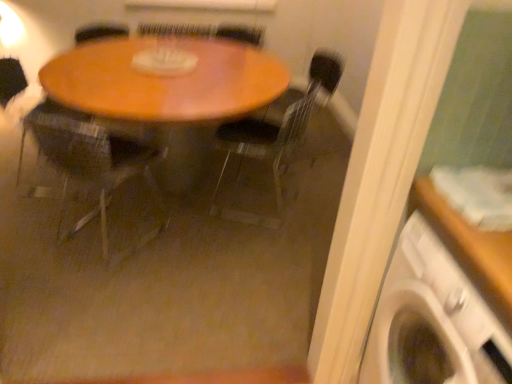
This screenshot has width=512, height=384. In order to click on wooden chair at center, marked as the second chair in a right-to-left arrangement in this screenshot , I will do `click(92, 162)`.

What do you see at coordinates (92, 162) in the screenshot? I see `wooden chair at center, marked as the second chair in a right-to-left arrangement` at bounding box center [92, 162].

In the scene shown: What is the approximate height of transparent plastic chair at center, which ranks as the first chair in right-to-left order?

29.28 inches.

Find the location of a particular element. The width and height of the screenshot is (512, 384). white plastic washing machine at lower right is located at coordinates (433, 321).

Locate an element on the screen. The height and width of the screenshot is (384, 512). wooden armchair at center is located at coordinates (11, 80).

The image size is (512, 384). What are the coordinates of `wooden table at center` in the screenshot? It's located at (166, 90).

Is point (267, 227) behind point (50, 65)?

Yes, it is.

Is transparent plastic chair at center, the 2th chair from the left, bigger or smaller than wooden table at center?

transparent plastic chair at center, the 2th chair from the left, is smaller than wooden table at center.

From the image's perspective, would you say transparent plastic chair at center, the 2th chair from the left, is shown under wooden table at center?

Yes, from the image's perspective, transparent plastic chair at center, the 2th chair from the left, is below wooden table at center.

Which is less distant, (97, 150) or (24, 80)?

Positioned in front is point (97, 150).

Considering the sizes of objects wooden chair at center, which appears as the first chair when viewed from the left, and wooden armchair at center in the image provided, who is smaller, wooden chair at center, which appears as the first chair when viewed from the left, or wooden armchair at center?

wooden armchair at center.

In the scene shown: Is there a large distance between wooden chair at center, marked as the second chair in a right-to-left arrangement, and wooden armchair at center?

wooden chair at center, marked as the second chair in a right-to-left arrangement, is actually quite close to wooden armchair at center.

Does transparent plastic chair at center, the 2th chair from the left, come behind wooden armchair at center?

No, it is not.

In the scene shown: Is transparent plastic chair at center, the 2th chair from the left, with wooden armchair at center?

They are not placed beside each other.

Can you confirm if transparent plastic chair at center, the 2th chair from the left, is shorter than wooden armchair at center?

No, transparent plastic chair at center, the 2th chair from the left, is not shorter than wooden armchair at center.

Considering the relative sizes of transparent plastic chair at center, the 2th chair from the left, and wooden armchair at center in the image provided, is transparent plastic chair at center, the 2th chair from the left, bigger than wooden armchair at center?

Yes, transparent plastic chair at center, the 2th chair from the left, is bigger than wooden armchair at center.

Could you measure the distance between wooden armchair at center and transparent plastic chair at center, which ranks as the first chair in right-to-left order?

The distance of wooden armchair at center from transparent plastic chair at center, which ranks as the first chair in right-to-left order, is 1.56 meters.

Does point (17, 61) come behind point (342, 63)?

That is False.

From a real-world perspective, who is located higher, wooden armchair at center or transparent plastic chair at center, which ranks as the first chair in right-to-left order?

In real-world perspective, wooden armchair at center is above.

Is wooden armchair at center not close to transparent plastic chair at center, the 2th chair from the left?

That's right, there is a large distance between wooden armchair at center and transparent plastic chair at center, the 2th chair from the left.

What are the coordinates of `armchair above the wooden chair at center, marked as the second chair in a right-to-left arrangement (from the image's perspective)` in the screenshot? It's located at (11, 80).

Does wooden armchair at center turn towards wooden chair at center, which appears as the first chair when viewed from the left?

No, wooden armchair at center is not facing towards wooden chair at center, which appears as the first chair when viewed from the left.

Is transparent plastic chair at center, which ranks as the first chair in right-to-left order, to the right of white plastic washing machine at lower right from the viewer's perspective?

No.

Measure the distance between transparent plastic chair at center, the 2th chair from the left, and white plastic washing machine at lower right.

They are 4.49 feet apart.

Who is taller, transparent plastic chair at center, which ranks as the first chair in right-to-left order, or white plastic washing machine at lower right?

With more height is white plastic washing machine at lower right.

Locate an element on the screen. The image size is (512, 384). washing machine in front of the transparent plastic chair at center, which ranks as the first chair in right-to-left order is located at coordinates (433, 321).

Is there a large distance between white plastic washing machine at lower right and wooden armchair at center?

That's right, there is a large distance between white plastic washing machine at lower right and wooden armchair at center.

Would you say white plastic washing machine at lower right is to the left or to the right of wooden armchair at center in the picture?

Clearly, white plastic washing machine at lower right is on the right of wooden armchair at center in the image.

Considering the relative sizes of white plastic washing machine at lower right and wooden armchair at center in the image provided, is white plastic washing machine at lower right taller than wooden armchair at center?

Yes, white plastic washing machine at lower right is taller than wooden armchair at center.

Can you confirm if white plastic washing machine at lower right is thinner than wooden armchair at center?

In fact, white plastic washing machine at lower right might be wider than wooden armchair at center.

From a real-world perspective, starting from the wooden table at center, which chair is the 2nd one vertically above it? Please provide its 2D coordinates.

[(274, 136)]

From a real-world perspective, which chair is the 2nd one underneath the wooden armchair at center? Please provide its 2D coordinates.

[(92, 162)]

Which object lies nearer to the anchor point wooden armchair at center, wooden chair at center, marked as the second chair in a right-to-left arrangement, or transparent plastic chair at center, which ranks as the first chair in right-to-left order?

Among the two, wooden chair at center, marked as the second chair in a right-to-left arrangement, is located nearer to wooden armchair at center.

When comparing their distances from transparent plastic chair at center, which ranks as the first chair in right-to-left order, does white plastic washing machine at lower right or wooden table at center seem further?

The object further to transparent plastic chair at center, which ranks as the first chair in right-to-left order, is white plastic washing machine at lower right.

Based on their spatial positions, is white plastic washing machine at lower right or transparent plastic chair at center, the 2th chair from the left, closer to wooden armchair at center?

The object closer to wooden armchair at center is transparent plastic chair at center, the 2th chair from the left.

When comparing their distances from wooden armchair at center, does white plastic washing machine at lower right or wooden table at center seem further?

Based on the image, white plastic washing machine at lower right appears to be further to wooden armchair at center.

Based on their spatial positions, is transparent plastic chair at center, the 2th chair from the left, or wooden table at center further from white plastic washing machine at lower right?

wooden table at center.

When comparing their distances from white plastic washing machine at lower right, does wooden table at center or wooden chair at center, which appears as the first chair when viewed from the left, seem closer?

Among the two, wooden chair at center, which appears as the first chair when viewed from the left, is located nearer to white plastic washing machine at lower right.

Estimate the real-world distances between objects in this image. Which object is further from transparent plastic chair at center, the 2th chair from the left, wooden table at center or wooden chair at center, marked as the second chair in a right-to-left arrangement?

Based on the image, wooden chair at center, marked as the second chair in a right-to-left arrangement, appears to be further to transparent plastic chair at center, the 2th chair from the left.

Looking at the image, which one is located closer to wooden chair at center, marked as the second chair in a right-to-left arrangement, transparent plastic chair at center, the 2th chair from the left, or white plastic washing machine at lower right?

transparent plastic chair at center, the 2th chair from the left, is positioned closer to the anchor wooden chair at center, marked as the second chair in a right-to-left arrangement.

This screenshot has width=512, height=384. Identify the location of table between wooden chair at center, marked as the second chair in a right-to-left arrangement, and white plastic washing machine at lower right. (166, 90).

Find the location of a particular element. The height and width of the screenshot is (384, 512). table between wooden chair at center, which appears as the first chair when viewed from the left, and transparent plastic chair at center, which ranks as the first chair in right-to-left order is located at coordinates (166, 90).

Find the location of a particular element. chair between wooden chair at center, marked as the second chair in a right-to-left arrangement, and white plastic washing machine at lower right from left to right is located at coordinates (274, 136).

I want to click on chair between wooden armchair at center and transparent plastic chair at center, the 2th chair from the left, in the horizontal direction, so click(92, 162).